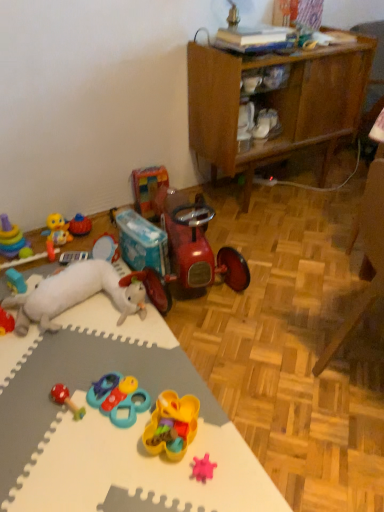
Find the location of `free area in between rubber duck at center, positioned as the 7th toy in right-to-left order, and rubberized red and green toy at lower left, the 7th toy from the left`. free area in between rubber duck at center, positioned as the 7th toy in right-to-left order, and rubberized red and green toy at lower left, the 7th toy from the left is located at coordinates (87, 339).